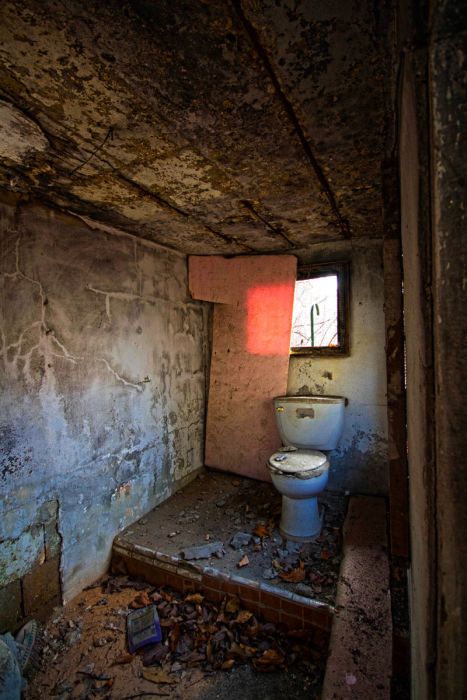
Find the location of `floor`. floor is located at coordinates (217, 528), (220, 682).